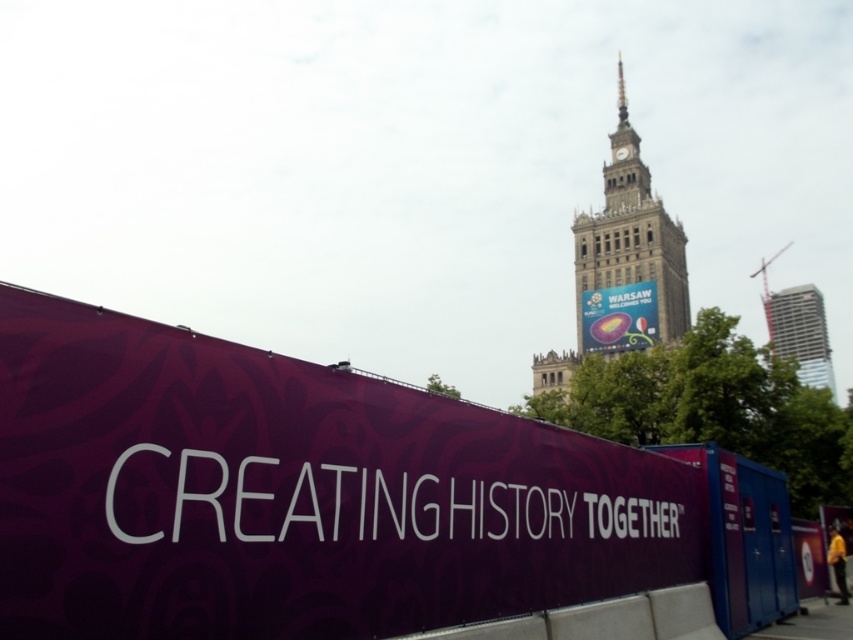
In the scene shown: Does stone clock tower at center have a lesser height compared to matte purple banner at center?

No.

Is point (624, 241) behind point (608, 317)?

Yes, point (624, 241) is farther from viewer.

Is point (602, 209) positioned behind point (592, 337)?

Yes.

I want to click on stone clock tower at center, so click(x=630, y=236).

Between purple matte banner at center and matte purple banner at center, which one appears on the left side from the viewer's perspective?

Positioned to the left is purple matte banner at center.

Does point (183, 468) come behind point (642, 337)?

No, (183, 468) is closer to viewer.

Locate an element on the screen. Image resolution: width=853 pixels, height=640 pixels. purple matte banner at center is located at coordinates (367, 502).

Between metallic glass skyscraper at upper right and matte purple banner at center, which one has less height?

matte purple banner at center is shorter.

Does metallic glass skyscraper at upper right have a greater width compared to matte purple banner at center?

Yes, metallic glass skyscraper at upper right is wider than matte purple banner at center.

Find the location of `metallic glass skyscraper at upper right`. metallic glass skyscraper at upper right is located at coordinates (801, 333).